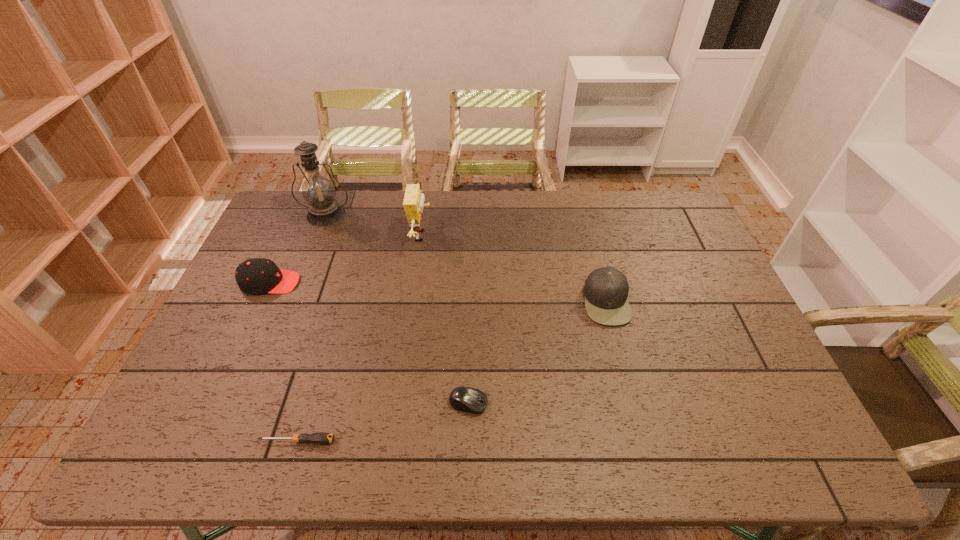
Locate an element on the screen. vacant space that's between the tallest object and the rightmost object is located at coordinates 467,258.

The image size is (960, 540). I want to click on blank region between the left cap and the tallest object, so click(x=299, y=248).

The image size is (960, 540). Identify the location of blank region between the shortest object and the left cap. click(x=284, y=362).

You are a GUI agent. You are given a task and a screenshot of the screen. Output one action in this format:
    pyautogui.click(x=<x>, y=<y>)
    Task: Click on the free space between the oil lamp and the fifth farthest object
    Image resolution: width=960 pixels, height=540 pixels.
    Given the screenshot: What is the action you would take?
    pyautogui.click(x=397, y=309)

The image size is (960, 540). I want to click on free space between the second shortest object and the rightmost object, so click(538, 352).

Locate an element on the screen. unoccupied position between the nearest object and the sponge is located at coordinates (360, 339).

Select which object is the third closest to the shortest object. Please provide its 2D coordinates. Your answer should be formatted as a tuple, i.e. [(x, y)], where the tuple contains the x and y coordinates of a point satisfying the conditions above.

[(413, 203)]

Where is `object that is the third nearest to the sponge`? object that is the third nearest to the sponge is located at coordinates (466, 399).

What are the coordinates of `vacant area that satisfies the following two spatial constraints: 1. on the front side of the oil lamp; 2. on the left side of the fifth object from left to right` in the screenshot? It's located at (252, 403).

The image size is (960, 540). I want to click on vacant region that satisfies the following two spatial constraints: 1. on the front-facing side of the shortest object; 2. on the right side of the left cap, so click(x=199, y=441).